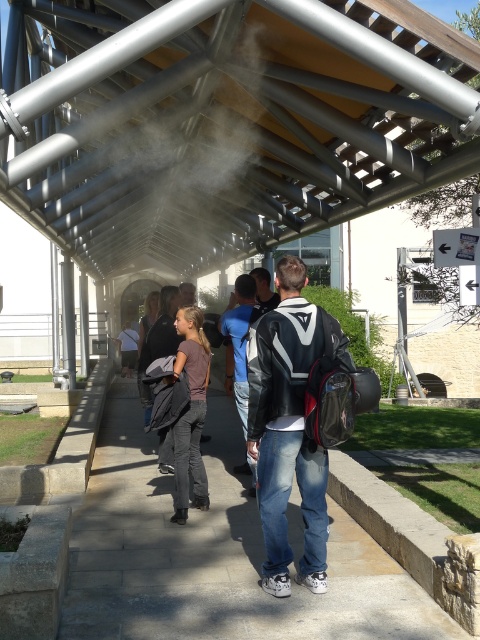
Between white fog at center and matte black jacket at center, which one has more height?

With more height is white fog at center.

Can you confirm if white fog at center is shorter than matte black jacket at center?

In fact, white fog at center may be taller than matte black jacket at center.

Which is behind, point (153, 257) or point (310, 321)?

The point (153, 257) is more distant.

You are a GUI agent. You are given a task and a screenshot of the screen. Output one action in this format:
    pyautogui.click(x=<x>, y=<y>)
    Task: Click on the white fog at center
    This screenshot has width=480, height=640.
    Given the screenshot: What is the action you would take?
    pos(217,148)

Who is shorter, matte black jacket at center or dark brown leather jacket at center?

Standing shorter between the two is dark brown leather jacket at center.

Does matte black jacket at center come in front of dark brown leather jacket at center?

Yes, matte black jacket at center is in front of dark brown leather jacket at center.

Is point (275, 420) positioned after point (193, 296)?

That is False.

The image size is (480, 640). Find the location of `matte black jacket at center`. matte black jacket at center is located at coordinates (288, 428).

From the picture: Is paved stone sidewalk at center to the left of dark brown leather jacket at center from the viewer's perspective?

No, paved stone sidewalk at center is not to the left of dark brown leather jacket at center.

Can you confirm if paved stone sidewalk at center is wider than dark brown leather jacket at center?

Correct, the width of paved stone sidewalk at center exceeds that of dark brown leather jacket at center.

The height and width of the screenshot is (640, 480). What are the coordinates of `paved stone sidewalk at center` in the screenshot? It's located at tap(216, 556).